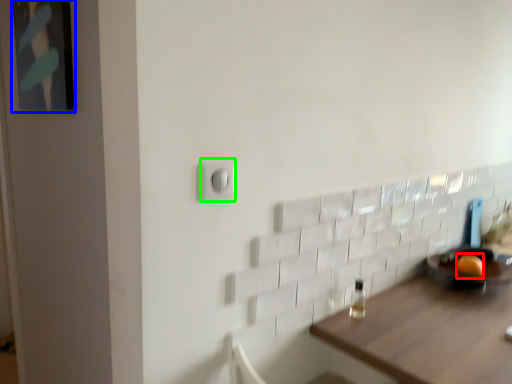
Question: Which is farther away from orange (highlighted by a red box)? picture frame (highlighted by a blue box) or light switch (highlighted by a green box)?

Choices:
 (A) picture frame
 (B) light switch

Answer: (A)